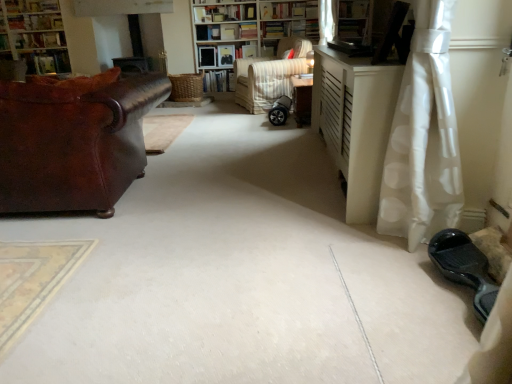
Question: From the image's perspective, is hardcover book at upper left, the 2th book when ordered from left to right, above white textured bookcase at center, placed as the second bookcase when sorted from left to right?

Choices:
 (A) yes
 (B) no

Answer: (B)

Question: Could white textured bookcase at center, placed as the second bookcase when sorted from left to right, be considered to be inside hardcover book at upper left, the 2th book when ordered from left to right?

Choices:
 (A) no
 (B) yes

Answer: (A)

Question: Is hardcover book at upper left, the 2th book when ordered from left to right, behind white textured bookcase at center, placed as the second bookcase when sorted from left to right?

Choices:
 (A) yes
 (B) no

Answer: (A)

Question: Is hardcover book at upper left, arranged as the fifth book when viewed from the right, looking in the opposite direction of white textured bookcase at center, which is the first bookcase in right-to-left order?

Choices:
 (A) no
 (B) yes

Answer: (A)

Question: Is hardcover book at upper left, the 2th book when ordered from left to right, oriented towards white textured bookcase at center, placed as the second bookcase when sorted from left to right?

Choices:
 (A) no
 (B) yes

Answer: (A)

Question: Can you confirm if hardcover book at upper left, the 2th book when ordered from left to right, is taller than white textured bookcase at center, which is the first bookcase in right-to-left order?

Choices:
 (A) no
 (B) yes

Answer: (A)

Question: Is hardcover books at center, which is the 4th book from right to left, closer to the viewer compared to hardcover books at upper center, the first book positioned from the right?

Choices:
 (A) no
 (B) yes

Answer: (A)

Question: Is hardcover books at center, which is the 3th book in left-to-right order, outside of hardcover books at upper center, which appears as the sixth book when viewed from the left?

Choices:
 (A) yes
 (B) no

Answer: (A)

Question: Is hardcover books at center, which is the 4th book from right to left, bigger than hardcover books at upper center, which appears as the sixth book when viewed from the left?

Choices:
 (A) yes
 (B) no

Answer: (B)

Question: Considering the relative sizes of hardcover books at center, which is the 3th book in left-to-right order, and hardcover books at upper center, the first book positioned from the right, in the image provided, is hardcover books at center, which is the 3th book in left-to-right order, thinner than hardcover books at upper center, the first book positioned from the right,?

Choices:
 (A) no
 (B) yes

Answer: (B)

Question: From the image's perspective, is hardcover books at center, which is the 3th book in left-to-right order, located above hardcover books at upper center, the first book positioned from the right?

Choices:
 (A) yes
 (B) no

Answer: (B)

Question: Is hardcover books at center, which is the 4th book from right to left, positioned far away from hardcover books at upper center, the first book positioned from the right?

Choices:
 (A) yes
 (B) no

Answer: (A)

Question: Considering the relative sizes of white dotted fabric at right and brown leather couch at left in the image provided, is white dotted fabric at right bigger than brown leather couch at left?

Choices:
 (A) no
 (B) yes

Answer: (A)